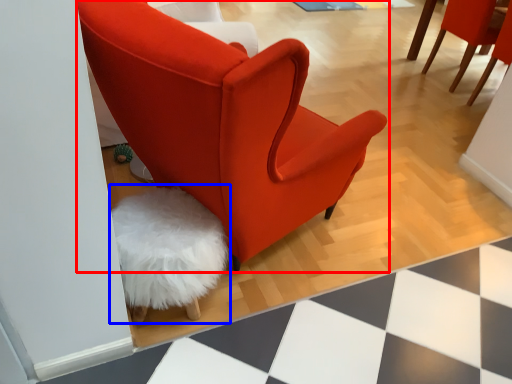
Question: Among these objects, which one is farthest to the camera, chair (highlighted by a red box) or swivel chair (highlighted by a blue box)?

Choices:
 (A) chair
 (B) swivel chair

Answer: (B)